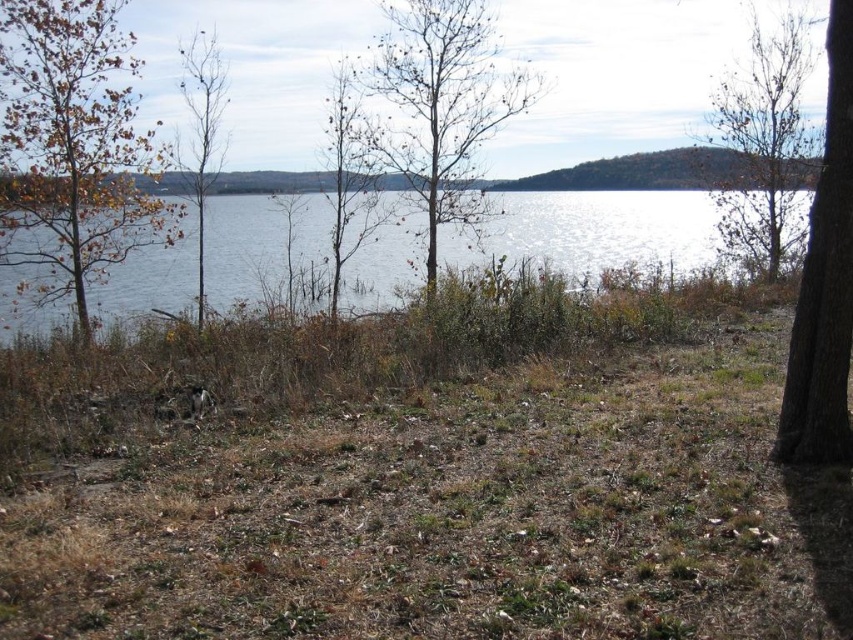
Can you confirm if brown dry grass at center is thinner than clear water at upper center?

Correct, brown dry grass at center's width is less than clear water at upper center's.

Is brown dry grass at center positioned in front of clear water at upper center?

Yes, brown dry grass at center is closer to the viewer.

Image resolution: width=853 pixels, height=640 pixels. I want to click on brown dry grass at center, so click(x=422, y=477).

Between yellowish-brown bark tree at left and brown leafy tree at upper right, which one is positioned higher?

brown leafy tree at upper right

Between point (13, 189) and point (757, 252), which one is positioned behind?

Positioned behind is point (757, 252).

The height and width of the screenshot is (640, 853). I want to click on yellowish-brown bark tree at left, so [73, 148].

Is brown dry grass at center to the left of brown leafy tree at upper right from the viewer's perspective?

Yes, brown dry grass at center is to the left of brown leafy tree at upper right.

At what (x,y) coordinates should I click in order to perform the action: click on brown dry grass at center. Please return your answer as a coordinate pair (x, y). The image size is (853, 640). Looking at the image, I should click on (422, 477).

Between point (515, 497) and point (778, 26), which one is positioned in front?

Positioned in front is point (515, 497).

Find the location of `brown dry grass at center`. brown dry grass at center is located at coordinates (422, 477).